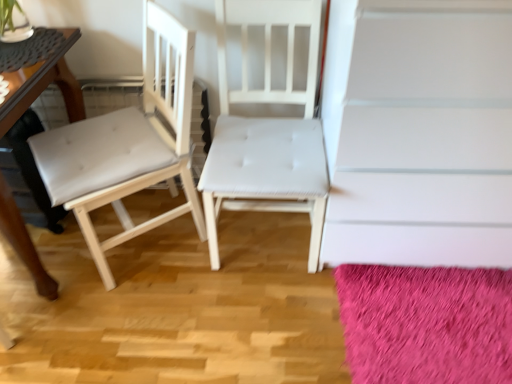
Question: Should I look upward or downward to see white fabric chair at center, placed as the second chair when sorted from left to right?

Choices:
 (A) down
 (B) up

Answer: (B)

Question: Considering the relative sizes of fuzzy pink rug at lower right and white fabric chair at center, placed as the second chair when sorted from left to right, in the image provided, is fuzzy pink rug at lower right taller than white fabric chair at center, placed as the second chair when sorted from left to right,?

Choices:
 (A) yes
 (B) no

Answer: (B)

Question: Can you confirm if fuzzy pink rug at lower right is wider than white fabric chair at center, which is the first chair from right to left?

Choices:
 (A) yes
 (B) no

Answer: (A)

Question: Is fuzzy pink rug at lower right looking in the opposite direction of white fabric chair at center, placed as the second chair when sorted from left to right?

Choices:
 (A) yes
 (B) no

Answer: (B)

Question: Considering the relative sizes of fuzzy pink rug at lower right and white fabric chair at center, which is the first chair from right to left, in the image provided, is fuzzy pink rug at lower right bigger than white fabric chair at center, which is the first chair from right to left,?

Choices:
 (A) yes
 (B) no

Answer: (B)

Question: Does fuzzy pink rug at lower right have a lesser width compared to white fabric chair at center, placed as the second chair when sorted from left to right?

Choices:
 (A) no
 (B) yes

Answer: (A)

Question: Considering the relative positions of fuzzy pink rug at lower right and white fabric chair at center, placed as the second chair when sorted from left to right, in the image provided, is fuzzy pink rug at lower right to the left of white fabric chair at center, placed as the second chair when sorted from left to right, from the viewer's perspective?

Choices:
 (A) no
 (B) yes

Answer: (A)

Question: Can you confirm if wooden table at left is wider than fuzzy pink rug at lower right?

Choices:
 (A) no
 (B) yes

Answer: (B)

Question: Considering the relative sizes of wooden table at left and fuzzy pink rug at lower right in the image provided, is wooden table at left thinner than fuzzy pink rug at lower right?

Choices:
 (A) yes
 (B) no

Answer: (B)

Question: Would you consider wooden table at left to be distant from fuzzy pink rug at lower right?

Choices:
 (A) no
 (B) yes

Answer: (B)

Question: From the image's perspective, is wooden table at left above fuzzy pink rug at lower right?

Choices:
 (A) yes
 (B) no

Answer: (A)

Question: From a real-world perspective, is wooden table at left positioned over fuzzy pink rug at lower right based on gravity?

Choices:
 (A) no
 (B) yes

Answer: (B)

Question: Is wooden table at left to the left of fuzzy pink rug at lower right from the viewer's perspective?

Choices:
 (A) yes
 (B) no

Answer: (A)

Question: From the image's perspective, is white leather chair at left, which ranks as the second chair in right-to-left order, below white matte stairwell at upper center?

Choices:
 (A) yes
 (B) no

Answer: (A)